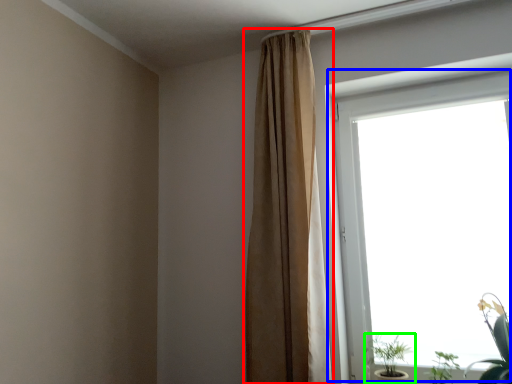
Question: Estimate the real-world distances between objects in this image. Which object is closer to curtain (highlighted by a red box), window (highlighted by a blue box) or houseplant (highlighted by a green box)?

Choices:
 (A) window
 (B) houseplant

Answer: (A)